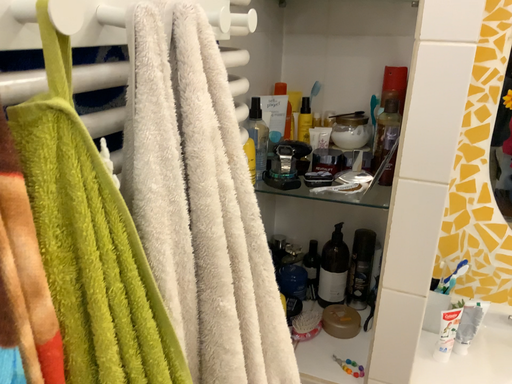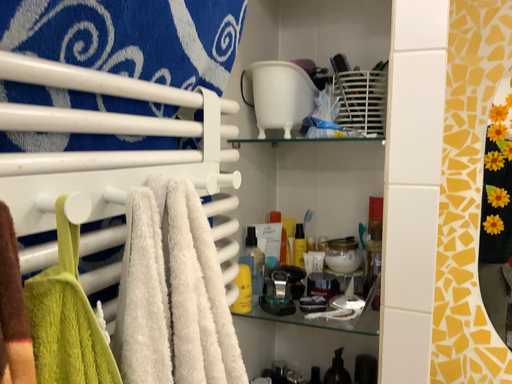
Question: How did the camera likely rotate when shooting the video?

Choices:
 (A) rotated downward
 (B) rotated upward

Answer: (B)